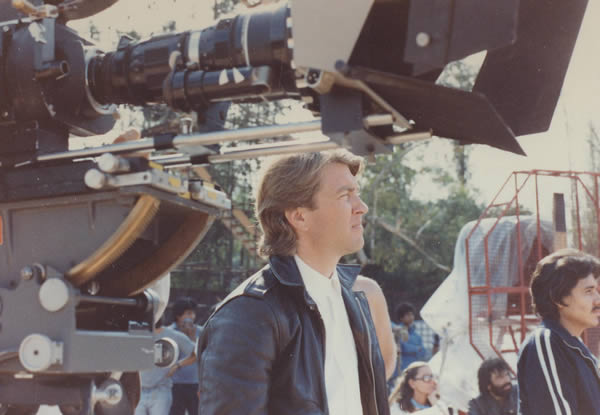
The image size is (600, 415). What are the coordinates of `knob` in the screenshot? It's located at (37, 356), (57, 301).